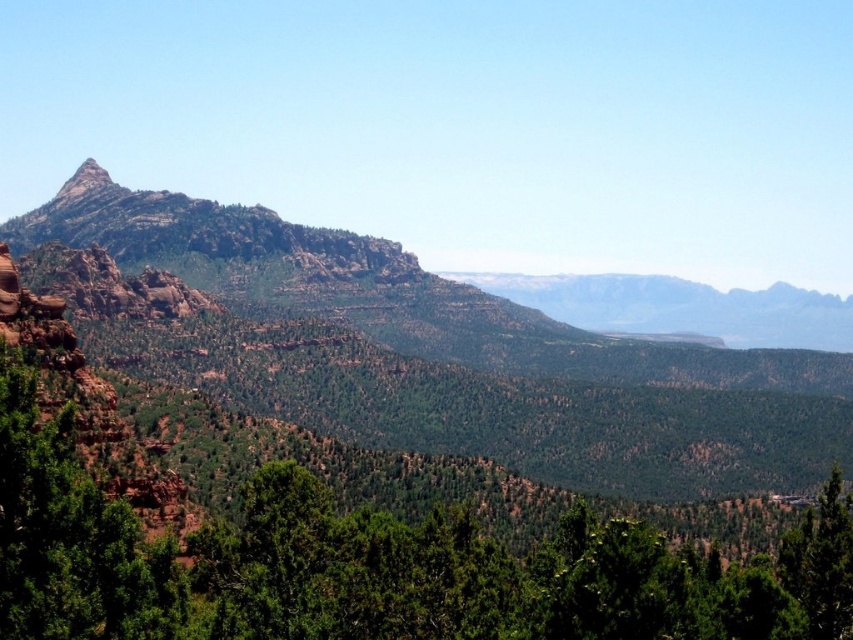
Which is in front, point (500, 628) or point (93, 170)?

Point (500, 628) is in front.

Describe the element at coordinates (372, 564) in the screenshot. I see `green textured tree at center` at that location.

Identify the location of green textured tree at center. The image size is (853, 640). (372, 564).

Between point (762, 477) and point (86, 170), which one is positioned behind?

Positioned behind is point (86, 170).

I want to click on rustic rock mountain range at left, so click(426, 372).

Can you confirm if rustic rock mountain range at left is taller than green textured tree at center?

Correct, rustic rock mountain range at left is much taller as green textured tree at center.

Locate an element on the screen. This screenshot has height=640, width=853. rustic rock mountain range at left is located at coordinates [426, 372].

The image size is (853, 640). I want to click on rustic rock mountain range at left, so click(426, 372).